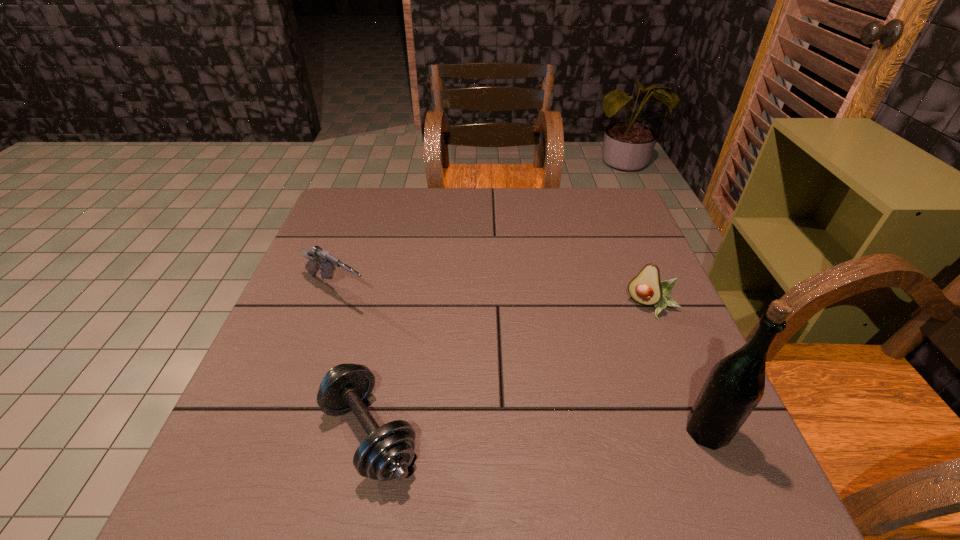
In the image, there is a desktop. Where is `vacant space at the left edge`? This screenshot has height=540, width=960. vacant space at the left edge is located at coordinates (357, 263).

The height and width of the screenshot is (540, 960). I want to click on vacant region at the right edge, so click(x=620, y=251).

In the image, there is a desktop. Where is `blank space at the far left corner`? blank space at the far left corner is located at coordinates (344, 206).

Find the location of a particular element. The height and width of the screenshot is (540, 960). free space at the far right corner of the desktop is located at coordinates (584, 205).

What are the coordinates of `vacant area between the beer bottle and the dumbbell` in the screenshot? It's located at (539, 433).

The height and width of the screenshot is (540, 960). In order to click on vacant space in between the gun and the tallest object in this screenshot , I will do `click(521, 361)`.

You are a GUI agent. You are given a task and a screenshot of the screen. Output one action in this format:
    pyautogui.click(x=<x>, y=<y>)
    Task: Click on the vacant point located between the avocado and the gun
    
    Given the screenshot: What is the action you would take?
    pyautogui.click(x=494, y=299)

This screenshot has width=960, height=540. Find the location of `unoccupied position between the dumbbell and the beer bottle`. unoccupied position between the dumbbell and the beer bottle is located at coordinates (539, 433).

Where is `vacant area between the beer bottle and the gun`? Image resolution: width=960 pixels, height=540 pixels. vacant area between the beer bottle and the gun is located at coordinates (521, 361).

Identify the location of free space between the avocado and the tallest object. (680, 369).